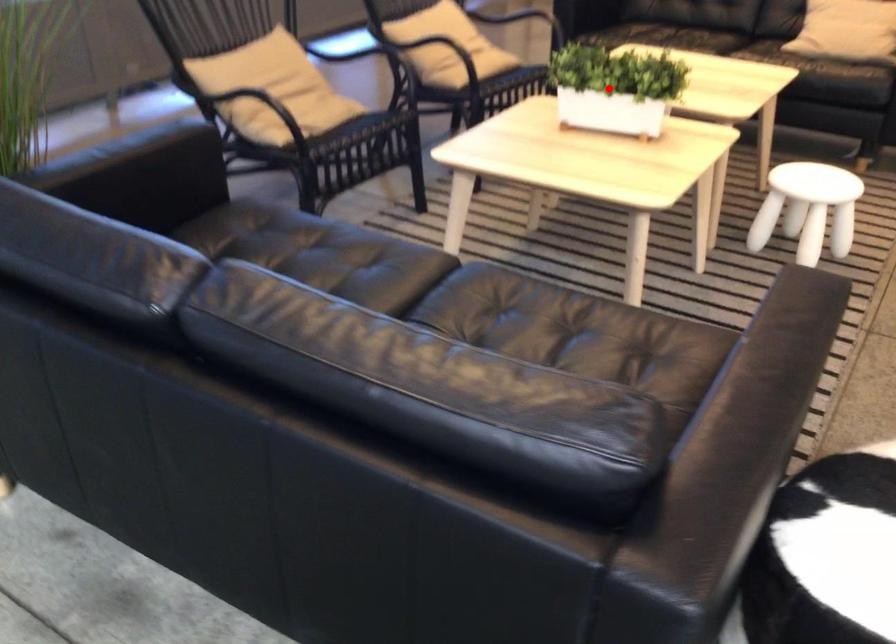
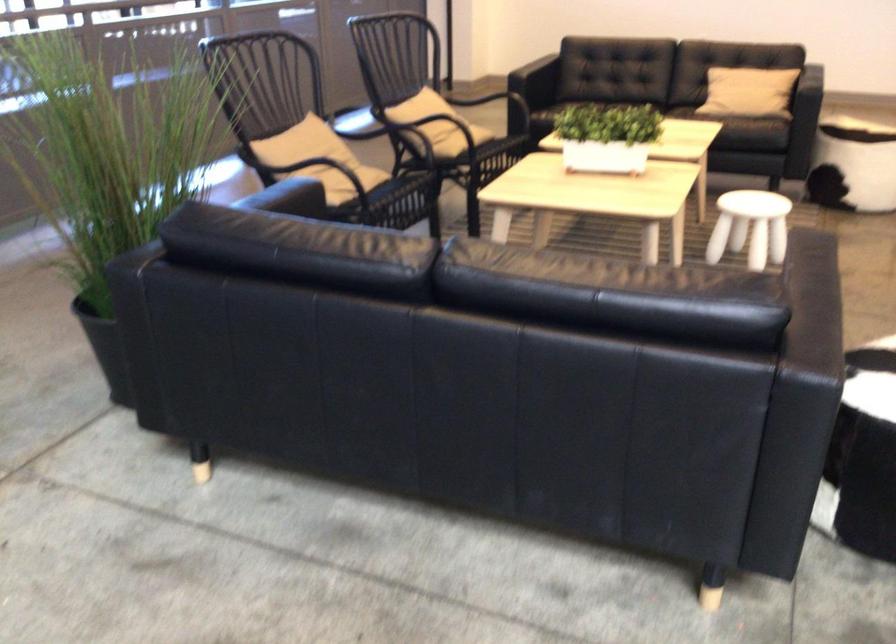
Question: I am providing you with two images of the same scene from different viewpoints. Given a red point in image1, look at the same physical point in image2. Is it:

Choices:
 (A) Closer to the viewpoint
 (B) Farther from the viewpoint

Answer: (B)